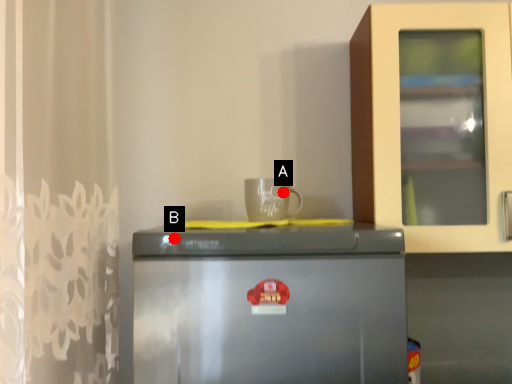
Question: Two points are circled on the image, labeled by A and B beside each circle. Which point appears farthest from the camera in this image?

Choices:
 (A) A is further
 (B) B is further

Answer: (A)